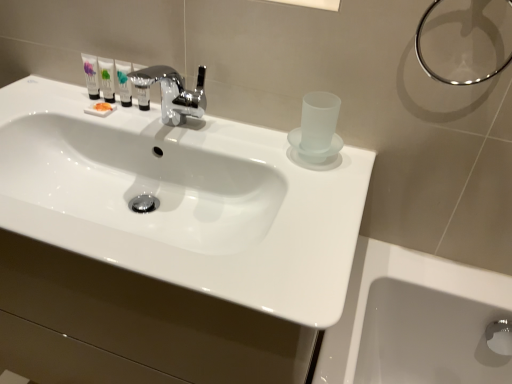
What is the approximate height of satin silver bottle at center, the first mouthwash when ordered from right to left?

The height of satin silver bottle at center, the first mouthwash when ordered from right to left, is 10.19 centimeters.

The image size is (512, 384). In order to click on matte white tube at upper left, the fourth mouthwash viewed from the right in this screenshot , I will do `click(91, 76)`.

Describe the element at coordinates (106, 79) in the screenshot. The image size is (512, 384). I see `matte white tube at upper left, which ranks as the 3th mouthwash in right-to-left order` at that location.

Locate an element on the screen. white glossy sink at center is located at coordinates (182, 200).

Where is `translucent plastic tube at upper center, which is the 2th mouthwash in right-to-left order`? This screenshot has width=512, height=384. translucent plastic tube at upper center, which is the 2th mouthwash in right-to-left order is located at coordinates (124, 82).

Considering the relative positions of matte white tube at upper left, the 1th mouthwash positioned from the left, and matte white tube at upper left, the 2th mouthwash from the left, in the image provided, is matte white tube at upper left, the 1th mouthwash positioned from the left, to the right of matte white tube at upper left, the 2th mouthwash from the left, from the viewer's perspective?

In fact, matte white tube at upper left, the 1th mouthwash positioned from the left, is to the left of matte white tube at upper left, the 2th mouthwash from the left.

In terms of width, does matte white tube at upper left, the fourth mouthwash viewed from the right, look wider or thinner when compared to matte white tube at upper left, which ranks as the 3th mouthwash in right-to-left order?

In the image, matte white tube at upper left, the fourth mouthwash viewed from the right, appears to be wider than matte white tube at upper left, which ranks as the 3th mouthwash in right-to-left order.

The width and height of the screenshot is (512, 384). Find the location of `shower lying above the matte white tube at upper left, the 2th mouthwash from the left (from the image's perspective)`. shower lying above the matte white tube at upper left, the 2th mouthwash from the left (from the image's perspective) is located at coordinates (439, 75).

Is matte white tube at upper left, the 2th mouthwash from the left, situated inside metallic ring at upper right or outside?

matte white tube at upper left, the 2th mouthwash from the left, is not enclosed by metallic ring at upper right.

From a real-world perspective, is matte white tube at upper left, which ranks as the 3th mouthwash in right-to-left order, physically below metallic ring at upper right?

Yes.

From the image's perspective, is matte white tube at upper left, which ranks as the 3th mouthwash in right-to-left order, beneath metallic ring at upper right?

Yes, from the image's perspective, matte white tube at upper left, which ranks as the 3th mouthwash in right-to-left order, is beneath metallic ring at upper right.

Which is correct: matte white tube at upper left, which ranks as the 3th mouthwash in right-to-left order, is inside white glossy sink at center, or outside of it?

matte white tube at upper left, which ranks as the 3th mouthwash in right-to-left order, lies outside white glossy sink at center.

From a real-world perspective, is matte white tube at upper left, the 2th mouthwash from the left, physically located above or below white glossy sink at center?

matte white tube at upper left, the 2th mouthwash from the left, is above white glossy sink at center.

What's the angular difference between metallic ring at upper right and matte white tube at upper left, which ranks as the 3th mouthwash in right-to-left order,'s facing directions?

The angle between the facing direction of metallic ring at upper right and the facing direction of matte white tube at upper left, which ranks as the 3th mouthwash in right-to-left order, is 4.74 degrees.

Which point is more forward, (x=506, y=64) or (x=106, y=85)?

The point (x=506, y=64) is closer.

From the image's perspective, is metallic ring at upper right on matte white tube at upper left, the 2th mouthwash from the left?

Correct, metallic ring at upper right appears higher than matte white tube at upper left, the 2th mouthwash from the left, in the image.

Consider the image. Does metallic ring at upper right have a greater height compared to matte white tube at upper left, which ranks as the 3th mouthwash in right-to-left order?

Yes, metallic ring at upper right is taller than matte white tube at upper left, which ranks as the 3th mouthwash in right-to-left order.

Is white glossy sink at center looking in the opposite direction of matte white tube at upper left, the 1th mouthwash positioned from the left?

No, matte white tube at upper left, the 1th mouthwash positioned from the left, is not at the back of white glossy sink at center.

Considering the points (262, 301) and (94, 81), which point is in front, point (262, 301) or point (94, 81)?

The point (262, 301) is closer.

What's the angular difference between white glossy sink at center and matte white tube at upper left, the 1th mouthwash positioned from the left,'s facing directions?

3.92 degrees.

Considering the sizes of objects white glossy sink at center and matte white tube at upper left, the fourth mouthwash viewed from the right, in the image provided, who is smaller, white glossy sink at center or matte white tube at upper left, the fourth mouthwash viewed from the right,?

matte white tube at upper left, the fourth mouthwash viewed from the right.

Is metallic ring at upper right looking in the opposite direction of white glossy sink at center?

No, metallic ring at upper right is not facing the opposite direction of white glossy sink at center.

Considering the sizes of objects metallic ring at upper right and white glossy sink at center in the image provided, who is shorter, metallic ring at upper right or white glossy sink at center?

Standing shorter between the two is white glossy sink at center.

How many degrees apart are the facing directions of metallic ring at upper right and white glossy sink at center?

The angle between the facing direction of metallic ring at upper right and the facing direction of white glossy sink at center is 0.814 degrees.

In terms of size, does metallic ring at upper right appear bigger or smaller than white glossy sink at center?

In the image, metallic ring at upper right appears to be smaller than white glossy sink at center.

Is satin silver bottle at center, which ranks as the 4th mouthwash in left-to-right order, positioned with its back to matte white tube at upper left, the fourth mouthwash viewed from the right?

satin silver bottle at center, which ranks as the 4th mouthwash in left-to-right order, does not have its back to matte white tube at upper left, the fourth mouthwash viewed from the right.

How different are the orientations of satin silver bottle at center, which ranks as the 4th mouthwash in left-to-right order, and matte white tube at upper left, the 1th mouthwash positioned from the left, in degrees?

0.0175 degrees.

Is point (132, 78) positioned before point (88, 86)?

Yes.

Identify the location of mouthwash that appears above the matte white tube at upper left, the 2th mouthwash from the left (from the image's perspective). The image size is (512, 384). (91, 76).

You are a GUI agent. You are given a task and a screenshot of the screen. Output one action in this format:
    pyautogui.click(x=<x>, y=<y>)
    Task: Click on the 3rd mouthwash counting from the left side of the metallic ring at upper right
    This screenshot has width=512, height=384.
    Given the screenshot: What is the action you would take?
    pyautogui.click(x=106, y=79)

Looking at the image, which one is located further to matte white tube at upper left, the 1th mouthwash positioned from the left, translucent plastic tube at upper center, which is the 2th mouthwash in right-to-left order, or metallic ring at upper right?

metallic ring at upper right lies further to matte white tube at upper left, the 1th mouthwash positioned from the left, than the other object.

Estimate the real-world distances between objects in this image. Which object is closer to white glossy sink at center, matte white tube at upper left, which ranks as the 3th mouthwash in right-to-left order, or metallic ring at upper right?

Among the two, matte white tube at upper left, which ranks as the 3th mouthwash in right-to-left order, is located nearer to white glossy sink at center.

From the image, which object appears to be nearer to matte white tube at upper left, the 1th mouthwash positioned from the left, translucent plastic tube at upper center, which is the 2th mouthwash in right-to-left order, or satin silver bottle at center, the first mouthwash when ordered from right to left?

translucent plastic tube at upper center, which is the 2th mouthwash in right-to-left order, is positioned closer to the anchor matte white tube at upper left, the 1th mouthwash positioned from the left.

Looking at the image, which one is located closer to white glossy sink at center, matte white tube at upper left, the 2th mouthwash from the left, or translucent plastic tube at upper center, the 3th mouthwash viewed from the left?

translucent plastic tube at upper center, the 3th mouthwash viewed from the left, is positioned closer to the anchor white glossy sink at center.

When comparing their distances from matte white tube at upper left, the 1th mouthwash positioned from the left, does satin silver bottle at center, which ranks as the 4th mouthwash in left-to-right order, or translucent plastic tube at upper center, which is the 2th mouthwash in right-to-left order, seem further?

Based on the image, satin silver bottle at center, which ranks as the 4th mouthwash in left-to-right order, appears to be further to matte white tube at upper left, the 1th mouthwash positioned from the left.

From the image, which object appears to be nearer to translucent plastic tube at upper center, the 3th mouthwash viewed from the left, metallic ring at upper right or matte white tube at upper left, the fourth mouthwash viewed from the right?

Based on the image, matte white tube at upper left, the fourth mouthwash viewed from the right, appears to be nearer to translucent plastic tube at upper center, the 3th mouthwash viewed from the left.

When comparing their distances from satin silver bottle at center, the first mouthwash when ordered from right to left, does matte white tube at upper left, the 2th mouthwash from the left, or matte white tube at upper left, the fourth mouthwash viewed from the right, seem closer?

matte white tube at upper left, the 2th mouthwash from the left, is closer to satin silver bottle at center, the first mouthwash when ordered from right to left.

When comparing their distances from translucent plastic tube at upper center, the 3th mouthwash viewed from the left, does matte white tube at upper left, the 2th mouthwash from the left, or metallic ring at upper right seem further?

Among the two, metallic ring at upper right is located further to translucent plastic tube at upper center, the 3th mouthwash viewed from the left.

At what (x,y) coordinates should I click in order to perform the action: click on mouthwash situated between translucent plastic tube at upper center, which is the 2th mouthwash in right-to-left order, and metallic ring at upper right from left to right. Please return your answer as a coordinate pair (x, y). Looking at the image, I should click on (141, 87).

Find the location of `sink between satin silver bottle at center, which ranks as the 4th mouthwash in left-to-right order, and metallic ring at upper right from left to right`. sink between satin silver bottle at center, which ranks as the 4th mouthwash in left-to-right order, and metallic ring at upper right from left to right is located at coordinates (182, 200).

This screenshot has height=384, width=512. I want to click on mouthwash between white glossy sink at center and translucent plastic tube at upper center, which is the 2th mouthwash in right-to-left order, along the z-axis, so click(x=141, y=87).

Find the location of a particular element. This screenshot has width=512, height=384. sink located between matte white tube at upper left, the 2th mouthwash from the left, and metallic ring at upper right in the left-right direction is located at coordinates (182, 200).